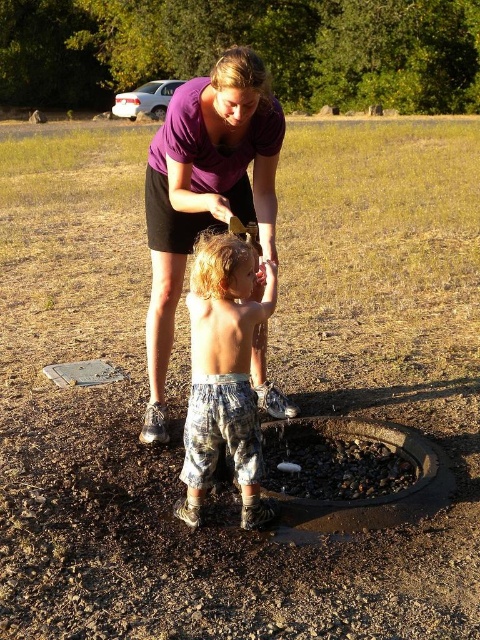
Question: Which object appears closest to the camera in this image?

Choices:
 (A) metallic gray hole at lower center
 (B) rusty metal manhole at center
 (C) camouflage pants at center
 (D) purple cotton shirt at upper center

Answer: (C)

Question: Which object appears farthest from the camera in this image?

Choices:
 (A) metallic gray hole at lower center
 (B) rusty metal manhole at center
 (C) purple cotton shirt at upper center

Answer: (A)

Question: Is the position of purple cotton shirt at upper center more distant than that of metallic gray hole at lower center?

Choices:
 (A) no
 (B) yes

Answer: (A)

Question: Does camouflage pants at center appear on the right side of rusty metal manhole at center?

Choices:
 (A) yes
 (B) no

Answer: (B)

Question: Which point is closer to the camera?

Choices:
 (A) (220, 138)
 (B) (226, 342)
 (C) (280, 444)

Answer: (B)

Question: Does purple cotton shirt at upper center have a greater width compared to camouflage pants at center?

Choices:
 (A) yes
 (B) no

Answer: (A)